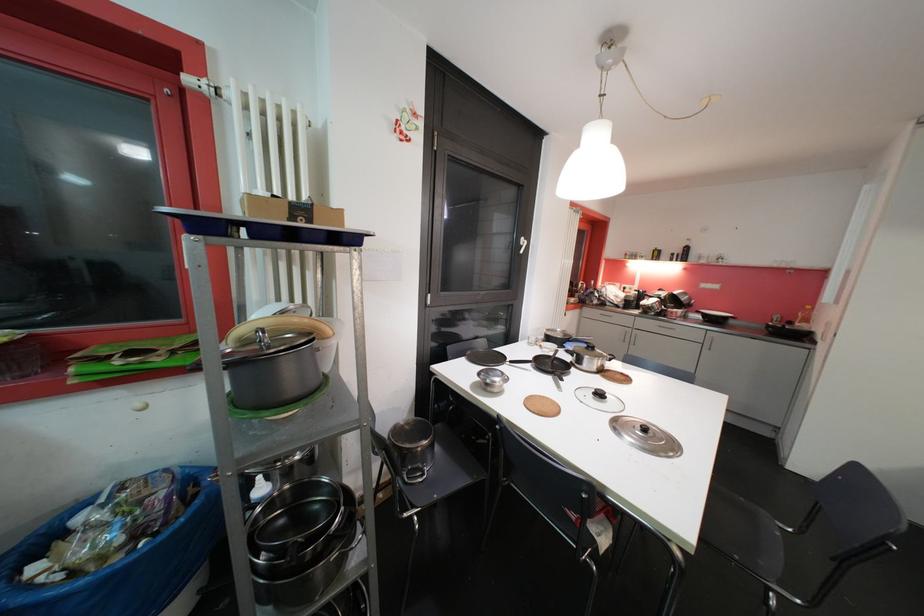
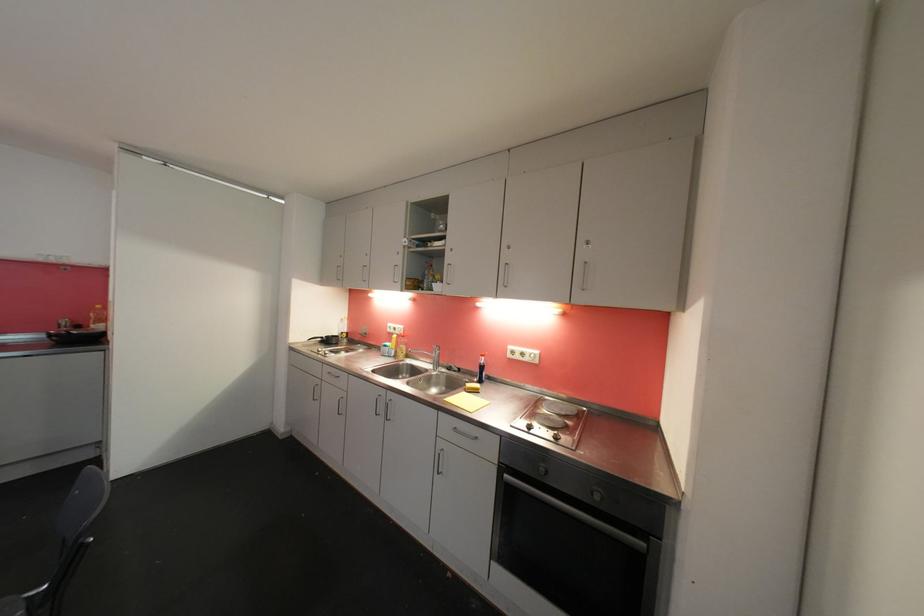
Locate, in the second image, the point that corresponds to [806,329] in the first image.

(102, 330)